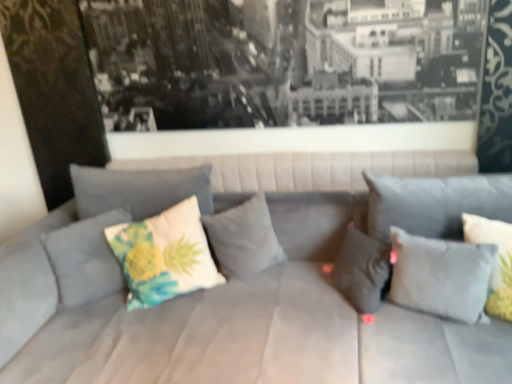
Where is `floral fabric pillow at center, marked as the 6th pillow in a right-to-left arrangement`? The width and height of the screenshot is (512, 384). floral fabric pillow at center, marked as the 6th pillow in a right-to-left arrangement is located at coordinates (85, 258).

In order to click on gray fabric pillow at center, marked as the 3th pillow in a right-to-left arrangement in this screenshot , I will do (x=362, y=270).

Describe the element at coordinates (495, 260) in the screenshot. This screenshot has width=512, height=384. I see `white fabric pillow at right, arranged as the first pillow when viewed from the right` at that location.

Image resolution: width=512 pixels, height=384 pixels. Describe the element at coordinates (214, 325) in the screenshot. I see `suede gray couch at center` at that location.

In order to face white fabric pillow with pineapple print at center, which is the 2th pillow from left to right, should I rotate leftwards or rightwards?

You should look left and rotate roughly 14.028 degrees.

In order to face gray fabric pillow at center, which is the 3th pillow from left to right, should I rotate leftwards or rightwards?

Turn left approximately 1.739 degrees to face it.

Where is `floral fabric pillow at center, marked as the 6th pillow in a right-to-left arrangement`? The image size is (512, 384). floral fabric pillow at center, marked as the 6th pillow in a right-to-left arrangement is located at coordinates (85, 258).

Would you say white matte pillow at right, which is counted as the 2th pillow, starting from the right, is to the left or to the right of white fabric pillow at right, the 6th pillow positioned from the left, in the picture?

white matte pillow at right, which is counted as the 2th pillow, starting from the right, is to the left of white fabric pillow at right, the 6th pillow positioned from the left.

From a real-world perspective, between white matte pillow at right, which is counted as the 2th pillow, starting from the right, and white fabric pillow at right, the 6th pillow positioned from the left, who is vertically lower?

In real-world perspective, white matte pillow at right, which is counted as the 2th pillow, starting from the right, is lower.

Considering the relative sizes of white matte pillow at right, which is the fifth pillow in left-to-right order, and white fabric pillow at right, the 6th pillow positioned from the left, in the image provided, is white matte pillow at right, which is the fifth pillow in left-to-right order, taller than white fabric pillow at right, the 6th pillow positioned from the left,?

In fact, white matte pillow at right, which is the fifth pillow in left-to-right order, may be shorter than white fabric pillow at right, the 6th pillow positioned from the left.

Is white matte pillow at right, which is the fifth pillow in left-to-right order, completely or partially outside of white fabric pillow at right, the 6th pillow positioned from the left?

That's correct, white matte pillow at right, which is the fifth pillow in left-to-right order, is outside of white fabric pillow at right, the 6th pillow positioned from the left.

In the scene shown: Is gray fabric pillow at center, marked as the fourth pillow in a left-to-right arrangement, oriented towards white matte pillow at right, which is counted as the 2th pillow, starting from the right?

A: No, gray fabric pillow at center, marked as the fourth pillow in a left-to-right arrangement, does not turn towards white matte pillow at right, which is counted as the 2th pillow, starting from the right.

How many degrees apart are the facing directions of gray fabric pillow at center, marked as the 3th pillow in a right-to-left arrangement, and white matte pillow at right, which is the fifth pillow in left-to-right order?

The angle between the facing direction of gray fabric pillow at center, marked as the 3th pillow in a right-to-left arrangement, and the facing direction of white matte pillow at right, which is the fifth pillow in left-to-right order, is 0.000868 degrees.

Considering their positions, is gray fabric pillow at center, marked as the fourth pillow in a left-to-right arrangement, located in front of or behind white matte pillow at right, which is the fifth pillow in left-to-right order?

gray fabric pillow at center, marked as the fourth pillow in a left-to-right arrangement, is positioned farther from the viewer than white matte pillow at right, which is the fifth pillow in left-to-right order.

Does gray fabric pillow at center, marked as the 3th pillow in a right-to-left arrangement, have a lesser height compared to white matte pillow at right, which is the fifth pillow in left-to-right order?

Correct, gray fabric pillow at center, marked as the 3th pillow in a right-to-left arrangement, is not as tall as white matte pillow at right, which is the fifth pillow in left-to-right order.

Does suede gray couch at center have a smaller size compared to floral fabric pillow at center, which appears as the first pillow when viewed from the left?

Actually, suede gray couch at center might be larger than floral fabric pillow at center, which appears as the first pillow when viewed from the left.

Considering the relative sizes of suede gray couch at center and floral fabric pillow at center, which appears as the first pillow when viewed from the left, in the image provided, is suede gray couch at center shorter than floral fabric pillow at center, which appears as the first pillow when viewed from the left,?

No.

Is suede gray couch at center wider than floral fabric pillow at center, which appears as the first pillow when viewed from the left?

Correct, the width of suede gray couch at center exceeds that of floral fabric pillow at center, which appears as the first pillow when viewed from the left.

Is suede gray couch at center outside of floral fabric pillow at center, which appears as the first pillow when viewed from the left?

Yes, suede gray couch at center is outside of floral fabric pillow at center, which appears as the first pillow when viewed from the left.

Based on the photo, can you confirm if white fabric pillow with pineapple print at center, which is the 2th pillow from left to right, is shorter than gray fabric pillow at center, positioned as the fourth pillow in right-to-left order?

In fact, white fabric pillow with pineapple print at center, which is the 2th pillow from left to right, may be taller than gray fabric pillow at center, positioned as the fourth pillow in right-to-left order.

Is gray fabric pillow at center, positioned as the fourth pillow in right-to-left order, surrounded by white fabric pillow with pineapple print at center, which is the 2th pillow from left to right?

No, gray fabric pillow at center, positioned as the fourth pillow in right-to-left order, is not inside white fabric pillow with pineapple print at center, which is the 2th pillow from left to right.

Consider the image. Which of these two, white fabric pillow with pineapple print at center, which is the 2th pillow from left to right, or gray fabric pillow at center, positioned as the fourth pillow in right-to-left order, is thinner?

gray fabric pillow at center, positioned as the fourth pillow in right-to-left order.

Which object is positioned more to the right, gray fabric pillow at center, marked as the 3th pillow in a right-to-left arrangement, or gray fabric pillow at center, positioned as the fourth pillow in right-to-left order?

From the viewer's perspective, gray fabric pillow at center, marked as the 3th pillow in a right-to-left arrangement, appears more on the right side.

Between gray fabric pillow at center, marked as the fourth pillow in a left-to-right arrangement, and gray fabric pillow at center, positioned as the fourth pillow in right-to-left order, which one has larger size?

gray fabric pillow at center, positioned as the fourth pillow in right-to-left order.

From the image's perspective, which is above, gray fabric pillow at center, marked as the 3th pillow in a right-to-left arrangement, or gray fabric pillow at center, positioned as the fourth pillow in right-to-left order?

gray fabric pillow at center, positioned as the fourth pillow in right-to-left order, is shown above in the image.

Locate an element on the screen. Image resolution: width=512 pixels, height=384 pixels. the 2nd pillow behind the gray fabric pillow at center, marked as the 3th pillow in a right-to-left arrangement is located at coordinates (243, 238).

Is floral fabric pillow at center, which appears as the first pillow when viewed from the left, far from suede gray couch at center?

No, there isn't a large distance between floral fabric pillow at center, which appears as the first pillow when viewed from the left, and suede gray couch at center.

Is floral fabric pillow at center, which appears as the first pillow when viewed from the left, thinner than suede gray couch at center?

Indeed, floral fabric pillow at center, which appears as the first pillow when viewed from the left, has a lesser width compared to suede gray couch at center.

Considering the relative positions of floral fabric pillow at center, which appears as the first pillow when viewed from the left, and suede gray couch at center in the image provided, is floral fabric pillow at center, which appears as the first pillow when viewed from the left, to the right of suede gray couch at center from the viewer's perspective?

No.

Is suede gray couch at center inside floral fabric pillow at center, marked as the 6th pillow in a right-to-left arrangement?

That's incorrect, suede gray couch at center is not inside floral fabric pillow at center, marked as the 6th pillow in a right-to-left arrangement.

Can you confirm if suede gray couch at center is positioned to the left of gray fabric pillow at center, marked as the 3th pillow in a right-to-left arrangement?

Indeed, suede gray couch at center is positioned on the left side of gray fabric pillow at center, marked as the 3th pillow in a right-to-left arrangement.

Is suede gray couch at center surrounding gray fabric pillow at center, marked as the fourth pillow in a left-to-right arrangement?

Yes, gray fabric pillow at center, marked as the fourth pillow in a left-to-right arrangement, is inside suede gray couch at center.

Consider the image. Is the surface of suede gray couch at center in direct contact with gray fabric pillow at center, marked as the 3th pillow in a right-to-left arrangement?

No, suede gray couch at center is not next to gray fabric pillow at center, marked as the 3th pillow in a right-to-left arrangement.

Is suede gray couch at center thinner than gray fabric pillow at center, marked as the 3th pillow in a right-to-left arrangement?

No, suede gray couch at center is not thinner than gray fabric pillow at center, marked as the 3th pillow in a right-to-left arrangement.

I want to click on pillow lying in front of the white matte pillow at right, which is counted as the 2th pillow, starting from the right, so click(x=495, y=260).

This screenshot has height=384, width=512. Find the location of `pillow directly beneath the white matte pillow at right, which is the fifth pillow in left-to-right order (from a real-world perspective)`. pillow directly beneath the white matte pillow at right, which is the fifth pillow in left-to-right order (from a real-world perspective) is located at coordinates (362, 270).

Estimate the real-world distances between objects in this image. Which object is closer to gray fabric pillow at center, marked as the 3th pillow in a right-to-left arrangement, white fabric pillow with pineapple print at center, the 5th pillow from the right, or floral fabric pillow at center, which appears as the first pillow when viewed from the left?

white fabric pillow with pineapple print at center, the 5th pillow from the right, lies closer to gray fabric pillow at center, marked as the 3th pillow in a right-to-left arrangement, than the other object.

From the image, which object appears to be farther from white fabric pillow at right, arranged as the first pillow when viewed from the right, suede gray couch at center or white fabric pillow with pineapple print at center, which is the 2th pillow from left to right?

white fabric pillow with pineapple print at center, which is the 2th pillow from left to right, lies further to white fabric pillow at right, arranged as the first pillow when viewed from the right, than the other object.

Considering their positions, is suede gray couch at center positioned further to floral fabric pillow at center, which appears as the first pillow when viewed from the left, than white matte pillow at right, which is counted as the 2th pillow, starting from the right?

Among the two, white matte pillow at right, which is counted as the 2th pillow, starting from the right, is located further to floral fabric pillow at center, which appears as the first pillow when viewed from the left.

Considering their positions, is gray fabric pillow at center, marked as the fourth pillow in a left-to-right arrangement, positioned closer to white matte pillow at right, which is the fifth pillow in left-to-right order, than white fabric pillow with pineapple print at center, which is the 2th pillow from left to right?

gray fabric pillow at center, marked as the fourth pillow in a left-to-right arrangement, is positioned closer to the anchor white matte pillow at right, which is the fifth pillow in left-to-right order.

Which object lies nearer to the anchor point white fabric pillow with pineapple print at center, the 5th pillow from the right, gray fabric pillow at center, which is the 3th pillow from left to right, or white fabric pillow at right, arranged as the first pillow when viewed from the right?

gray fabric pillow at center, which is the 3th pillow from left to right.

Based on their spatial positions, is floral fabric pillow at center, which appears as the first pillow when viewed from the left, or gray fabric pillow at center, marked as the fourth pillow in a left-to-right arrangement, closer to white fabric pillow with pineapple print at center, the 5th pillow from the right?

The object closer to white fabric pillow with pineapple print at center, the 5th pillow from the right, is floral fabric pillow at center, which appears as the first pillow when viewed from the left.

From the image, which object appears to be nearer to white fabric pillow at right, the 6th pillow positioned from the left, gray fabric pillow at center, marked as the fourth pillow in a left-to-right arrangement, or white matte pillow at right, which is the fifth pillow in left-to-right order?

white matte pillow at right, which is the fifth pillow in left-to-right order, is positioned closer to the anchor white fabric pillow at right, the 6th pillow positioned from the left.

Which object lies nearer to the anchor point white fabric pillow with pineapple print at center, which is the 2th pillow from left to right, white matte pillow at right, which is counted as the 2th pillow, starting from the right, or floral fabric pillow at center, which appears as the first pillow when viewed from the left?

floral fabric pillow at center, which appears as the first pillow when viewed from the left, is closer to white fabric pillow with pineapple print at center, which is the 2th pillow from left to right.

Image resolution: width=512 pixels, height=384 pixels. What are the coordinates of `studio couch situated between white fabric pillow with pineapple print at center, which is the 2th pillow from left to right, and white matte pillow at right, which is counted as the 2th pillow, starting from the right, from left to right` in the screenshot? It's located at (214, 325).

Locate an element on the screen. pillow between gray fabric pillow at center, positioned as the fourth pillow in right-to-left order, and white matte pillow at right, which is counted as the 2th pillow, starting from the right, in the horizontal direction is located at coordinates (362, 270).

I want to click on pillow between floral fabric pillow at center, which appears as the first pillow when viewed from the left, and gray fabric pillow at center, positioned as the fourth pillow in right-to-left order, from left to right, so click(164, 255).

You are a GUI agent. You are given a task and a screenshot of the screen. Output one action in this format:
    pyautogui.click(x=<x>, y=<y>)
    Task: Click on the studio couch situated between floral fabric pillow at center, which appears as the first pillow when viewed from the left, and white matte pillow at right, which is the fifth pillow in left-to-right order, from left to right
    
    Given the screenshot: What is the action you would take?
    pyautogui.click(x=214, y=325)